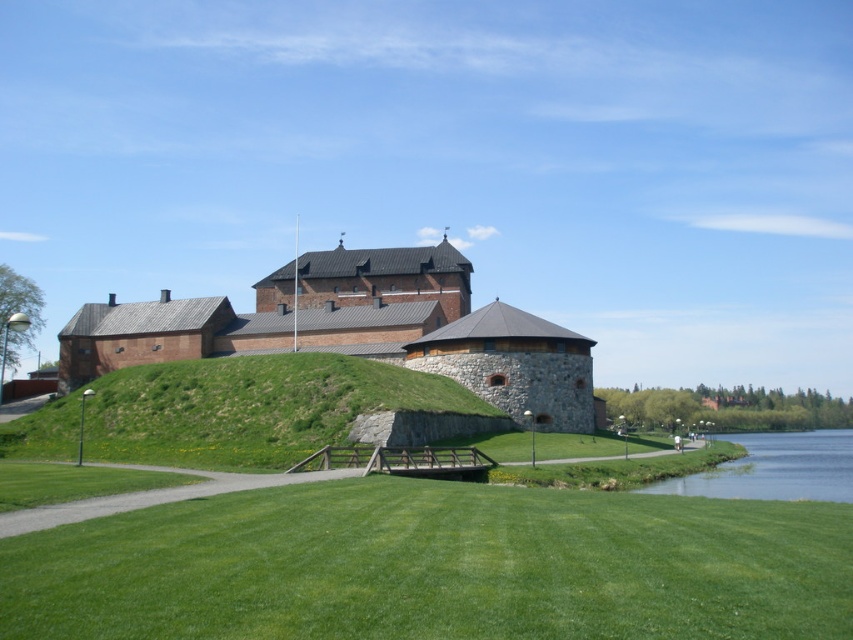
Which is below, green grass at lower center or brown stone castle at center?

green grass at lower center

Is point (697, 593) less distant than point (277, 284)?

Yes, point (697, 593) is in front of point (277, 284).

This screenshot has height=640, width=853. I want to click on green grass at lower center, so click(x=434, y=566).

Between brown stone castle at center and green grassy hillside at center, which one has more height?

brown stone castle at center

Between brown stone castle at center and green grassy hillside at center, which one appears on the left side from the viewer's perspective?

Positioned to the left is green grassy hillside at center.

What are the coordinates of `brown stone castle at center` in the screenshot? It's located at (357, 330).

Locate an element on the screen. brown stone castle at center is located at coordinates (357, 330).

Between point (633, 579) and point (413, 397), which one is positioned in front?

Point (633, 579)

Where is `green grass at lower center`? green grass at lower center is located at coordinates (434, 566).

What do you see at coordinates (434, 566) in the screenshot? I see `green grass at lower center` at bounding box center [434, 566].

Find the location of a particular element. green grass at lower center is located at coordinates (434, 566).